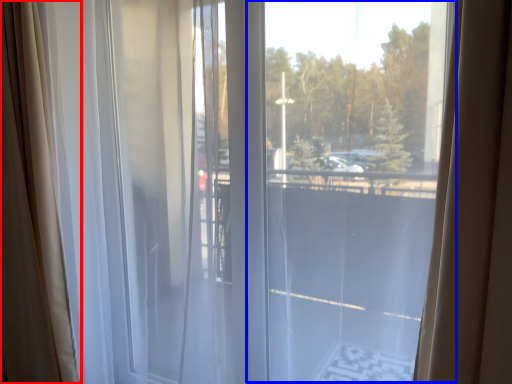
Question: Which point is further to the camera, curtain (highlighted by a red box) or glass window (highlighted by a blue box)?

Choices:
 (A) curtain
 (B) glass window

Answer: (A)